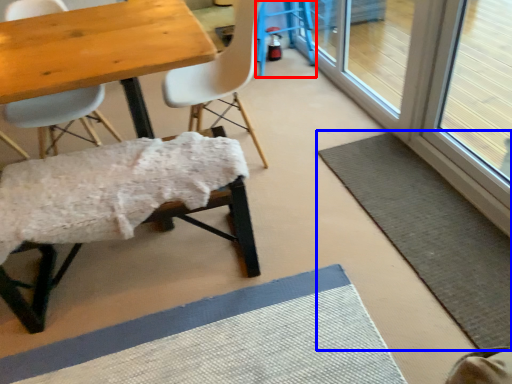
Question: Which object appears farthest to the camera in this image, bar stool (highlighted by a red box) or bath mat (highlighted by a blue box)?

Choices:
 (A) bar stool
 (B) bath mat

Answer: (A)